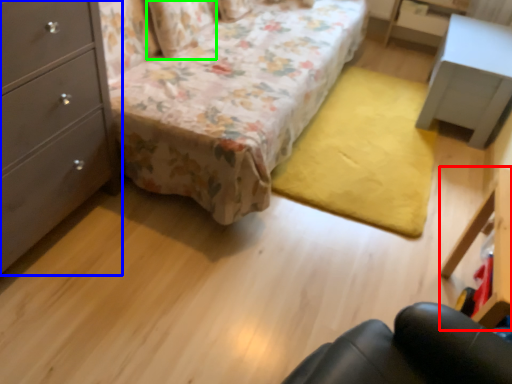
Question: Considering the real-world distances, which object is farthest from vanity (highlighted by a red box)? chest of drawers (highlighted by a blue box) or pillow (highlighted by a green box)?

Choices:
 (A) chest of drawers
 (B) pillow

Answer: (B)